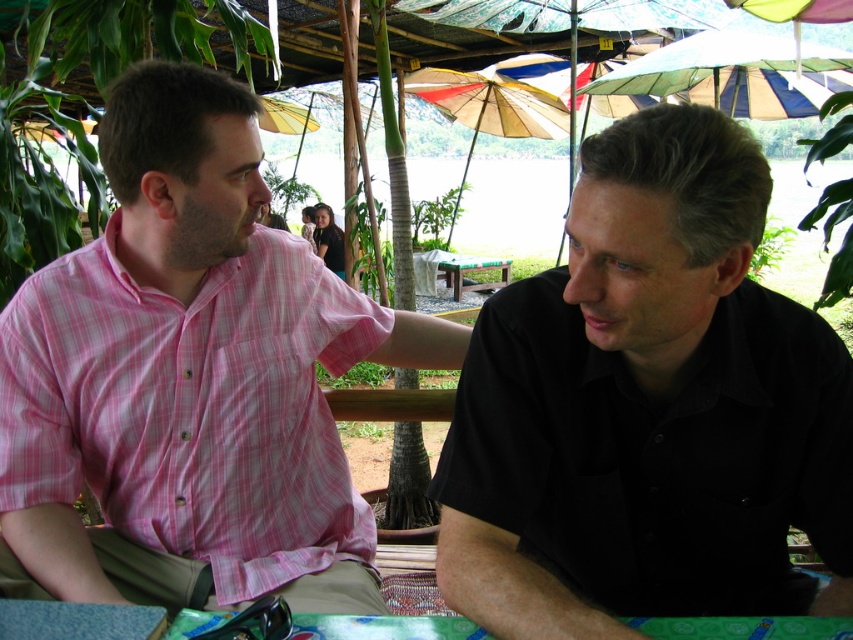
Question: Is black matte shirt at right to the right of multi-colored paper umbrella at center from the viewer's perspective?

Choices:
 (A) no
 (B) yes

Answer: (B)

Question: Which of the following is the closest to the observer?

Choices:
 (A) multi-colored paper umbrella at center
 (B) blue and white striped umbrella at upper center
 (C) pink checkered shirt at left

Answer: (C)

Question: In this image, where is black matte shirt at right located relative to pink checkered shirt at left?

Choices:
 (A) above
 (B) below

Answer: (B)

Question: Which object appears farthest from the camera in this image?

Choices:
 (A) blue and white striped umbrella at upper center
 (B) multi-colored paper umbrella at center
 (C) pink checkered shirt at left

Answer: (B)

Question: Which object appears closest to the camera in this image?

Choices:
 (A) multi-colored paper umbrella at center
 (B) black matte shirt at right
 (C) blue and white striped umbrella at upper center
 (D) pink checkered shirt at left

Answer: (B)

Question: From the image, what is the correct spatial relationship of multi-colored paper umbrella at center in relation to wooden table at center?

Choices:
 (A) left
 (B) right

Answer: (A)